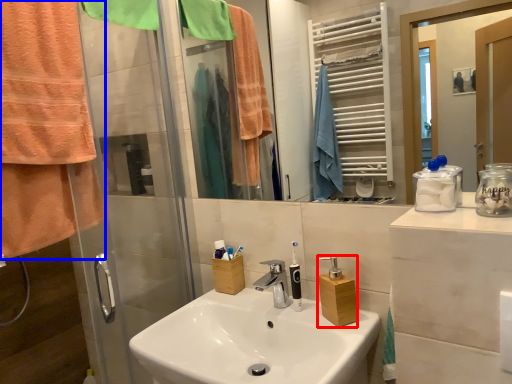
Question: Which of the following is the farthest to the observer, bottle (highlighted by a red box) or towel/napkin (highlighted by a blue box)?

Choices:
 (A) bottle
 (B) towel/napkin

Answer: (A)